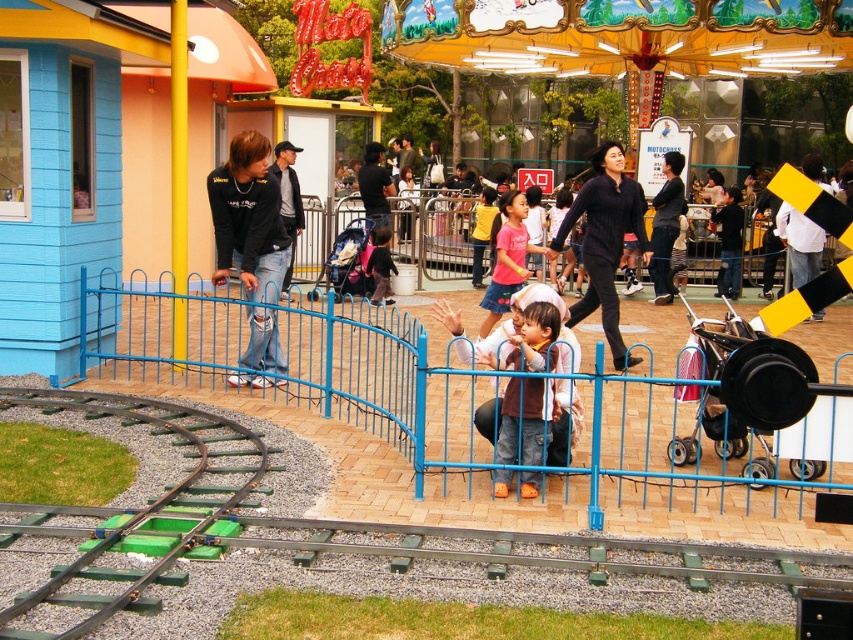
Question: Which of the following is the closest to the observer?

Choices:
 (A) 656,305
 (B) 114,403

Answer: (B)

Question: Which object is farther from the camera taking this photo?

Choices:
 (A) black knit sweater at center
 (B) matte pink shirt at center
 (C) black matte jacket at center

Answer: (B)

Question: Does black matte jacket at center appear on the right side of jeans at center?

Choices:
 (A) yes
 (B) no

Answer: (A)

Question: Which point is closer to the camera?

Choices:
 (A) (808, 164)
 (B) (276, 346)
 (C) (657, 248)

Answer: (B)

Question: Does black matte jacket at center have a greater width compared to matte black shirt at center?

Choices:
 (A) no
 (B) yes

Answer: (B)

Question: Is jeans at center smaller than matte pink shirt at center?

Choices:
 (A) no
 (B) yes

Answer: (A)